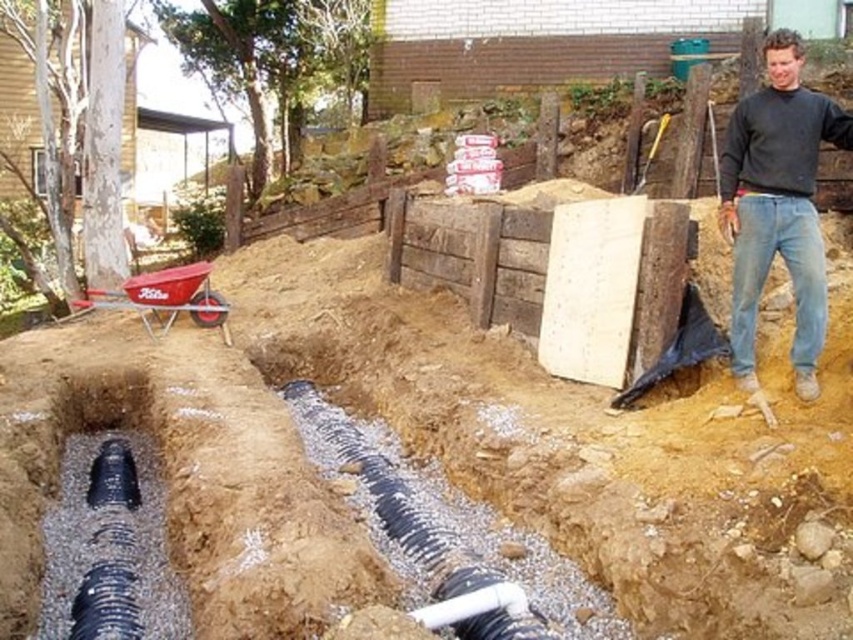
You are a construction worker who needs to place a new pipe segment near the trench. The trench has a black perforated pipe running through it. There is a point marked at coordinates (109, 529). What object is located at that point?

The black rubber pipe at lower left is located at point (109, 529).

You are a surveyor standing at the construction site. You need to determine the distance between the two points marked in the image. Which point is closer to you, point [172,618] or point [785,99]?

Point [172,618] is closer to the viewer than point [785,99].